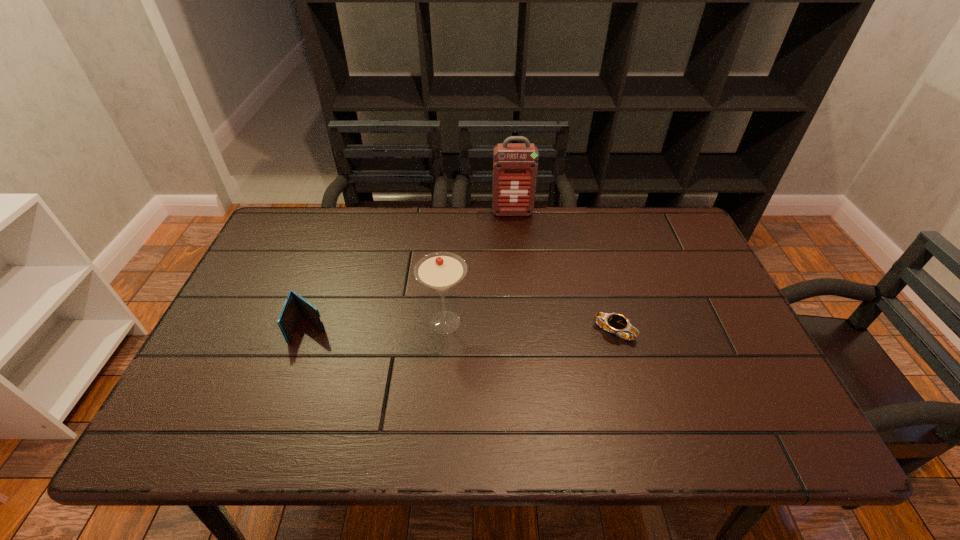
Find the location of a particular element. The width and height of the screenshot is (960, 540). the farthest object is located at coordinates point(515,166).

Image resolution: width=960 pixels, height=540 pixels. What are the coordinates of `the first-aid kit` in the screenshot? It's located at (515, 166).

I want to click on the second tallest object, so click(440, 271).

The width and height of the screenshot is (960, 540). Find the location of `the third object from right to left`. the third object from right to left is located at coordinates (440, 271).

Where is `the third tallest object`? The image size is (960, 540). the third tallest object is located at coordinates (295, 305).

You are a GUI agent. You are given a task and a screenshot of the screen. Output one action in this format:
    pyautogui.click(x=<x>, y=<y>)
    Task: Click on the wallet
    The image size is (960, 540).
    Given the screenshot: What is the action you would take?
    pyautogui.click(x=295, y=305)

This screenshot has height=540, width=960. Find the location of `the rightmost object`. the rightmost object is located at coordinates (618, 324).

Locate an element on the screen. The image size is (960, 540). the shortest object is located at coordinates (618, 324).

Find the location of a particular element. vacant area located 0.060m on the front-facing side of the farthest object is located at coordinates (514, 228).

You are a GUI agent. You are given a task and a screenshot of the screen. Output one action in this format:
    pyautogui.click(x=<x>, y=<y>)
    Task: Click on the vacant space located 0.190m on the back of the martini
    
    Given the screenshot: What is the action you would take?
    pyautogui.click(x=449, y=258)